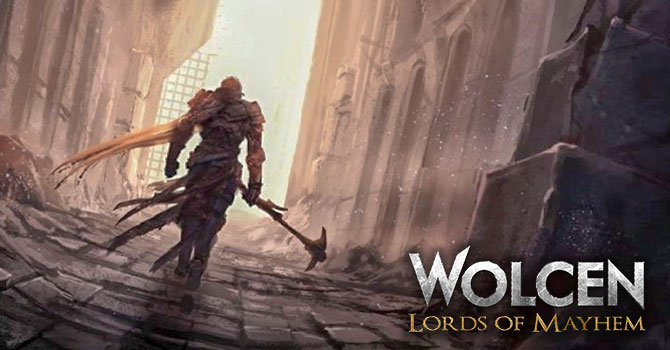
Identify the location of light source. (287, 20).